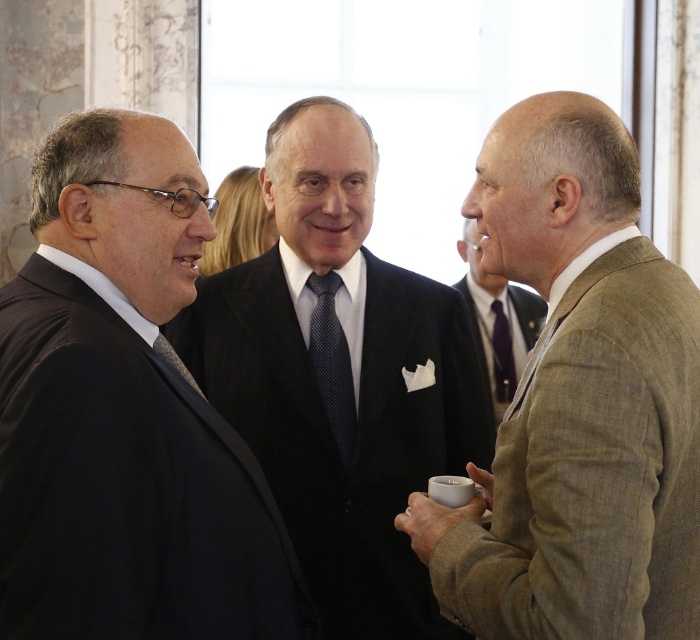
Question: Does tan textured suit at right have a larger size compared to matte black tie at center?

Choices:
 (A) no
 (B) yes

Answer: (B)

Question: Is matte black suit at left below dark blue dotted tie at center?

Choices:
 (A) yes
 (B) no

Answer: (A)

Question: Which of the following is the closest to the observer?

Choices:
 (A) (472, 252)
 (B) (496, 381)

Answer: (B)

Question: Among these objects, which one is farthest from the camera?

Choices:
 (A) dark suit at center
 (B) light brown textured suit at right

Answer: (B)

Question: Can you confirm if tan textured suit at right is positioned to the right of matte black tie at center?

Choices:
 (A) yes
 (B) no

Answer: (B)

Question: Estimate the real-world distances between objects in this image. Which object is farther from the light brown textured suit at right?

Choices:
 (A) dark blue dotted tie at center
 (B) tan textured suit at right

Answer: (B)